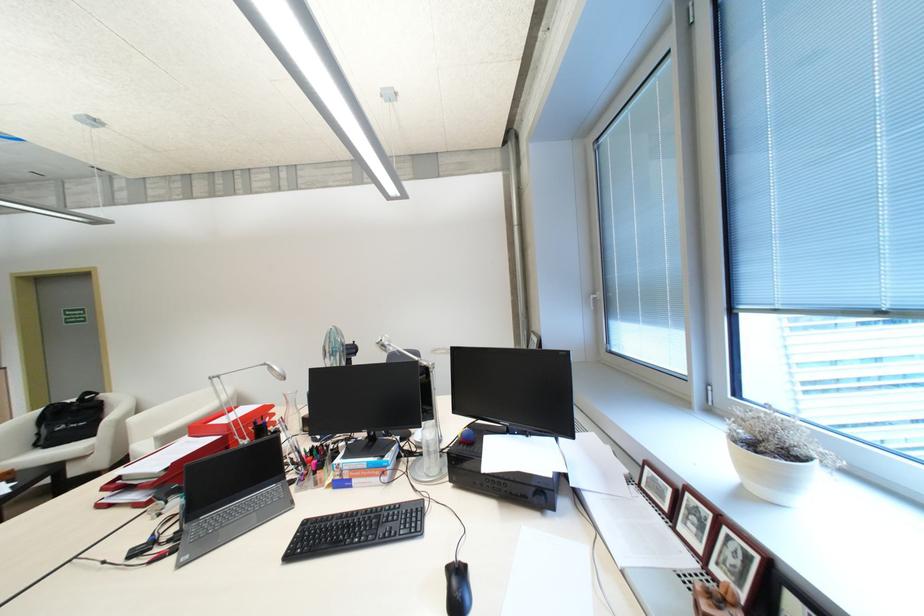
Find where to turn the white window handle. Please return your answer as a coordinate pair (x, y).

(593, 299)